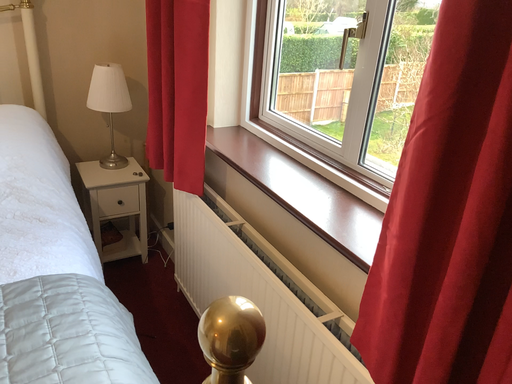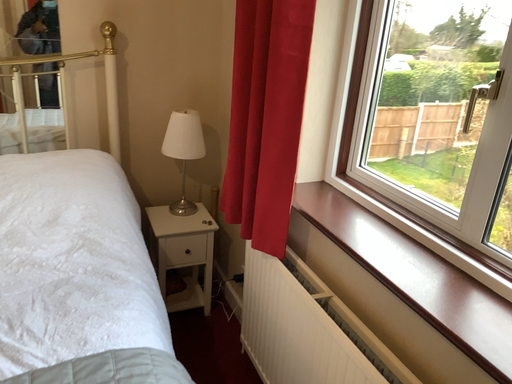
Question: Which way did the camera rotate in the video?

Choices:
 (A) rotated right
 (B) rotated left

Answer: (B)